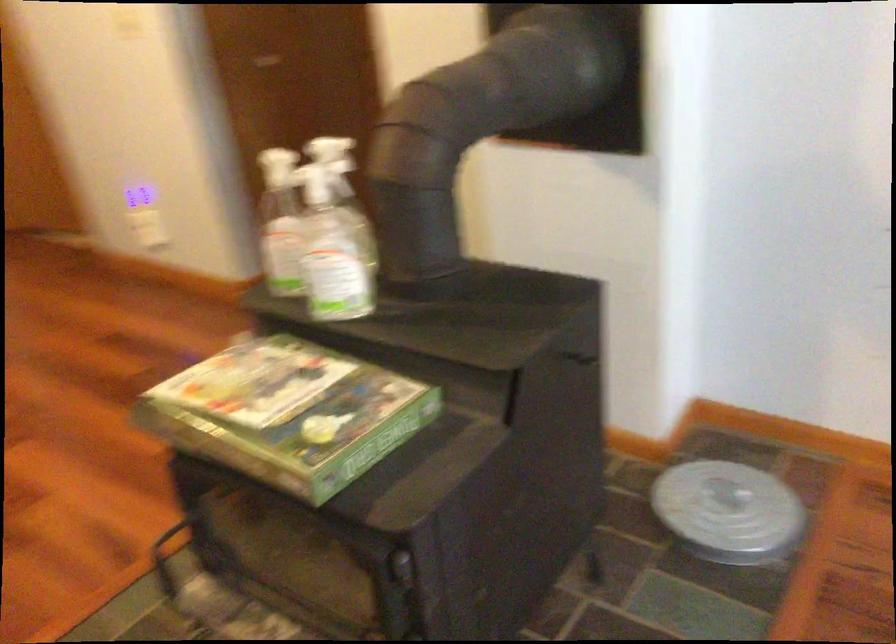
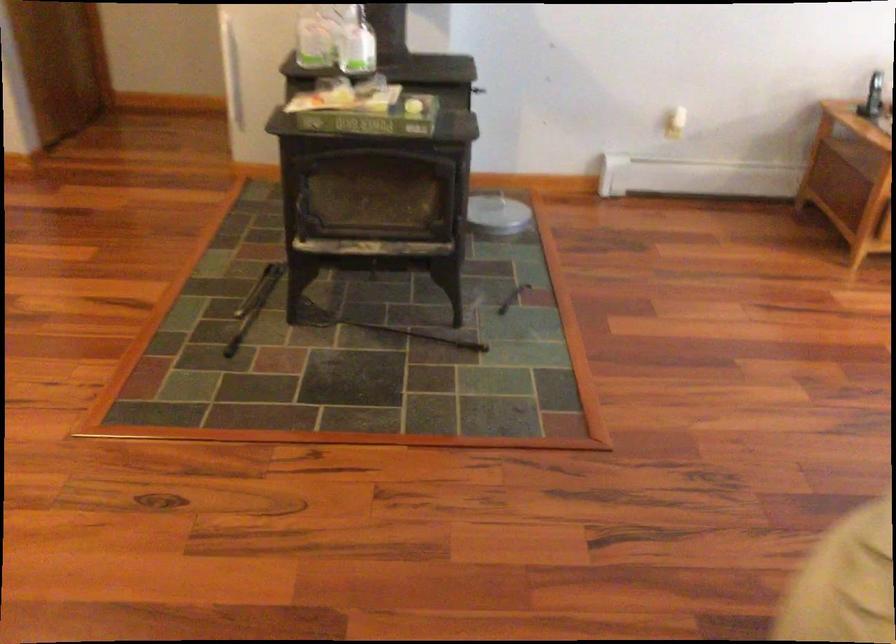
Where in the second image is the point corresponding to point 768,279 from the first image?

(477, 90)